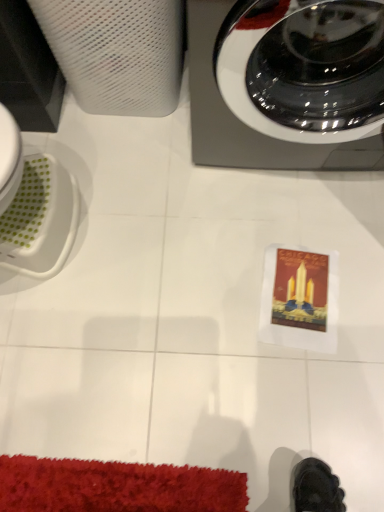
The height and width of the screenshot is (512, 384). What are the coordinates of `free location in front of metallic gray washing machine at upper right` in the screenshot? It's located at (270, 262).